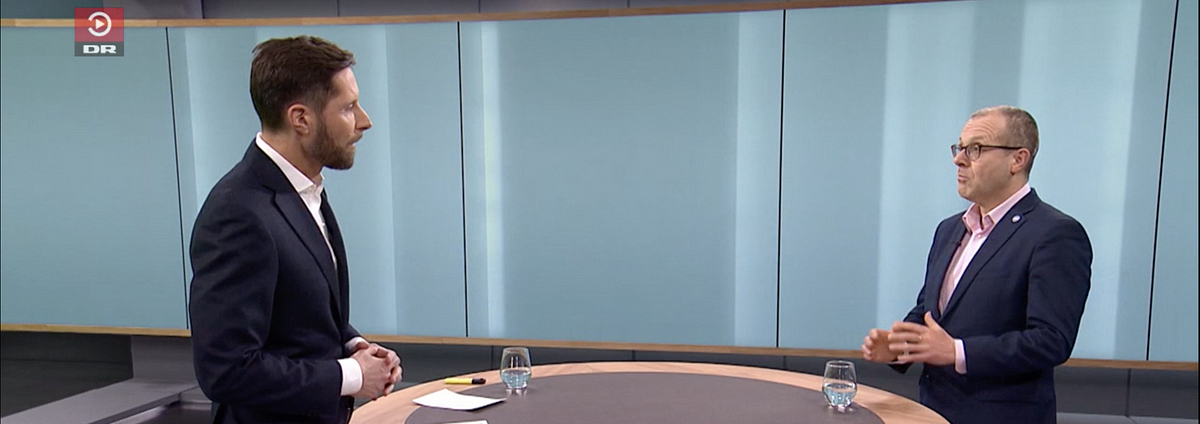
The height and width of the screenshot is (424, 1200). What are the coordinates of `glasses of water` in the screenshot? It's located at (522, 366), (842, 386).